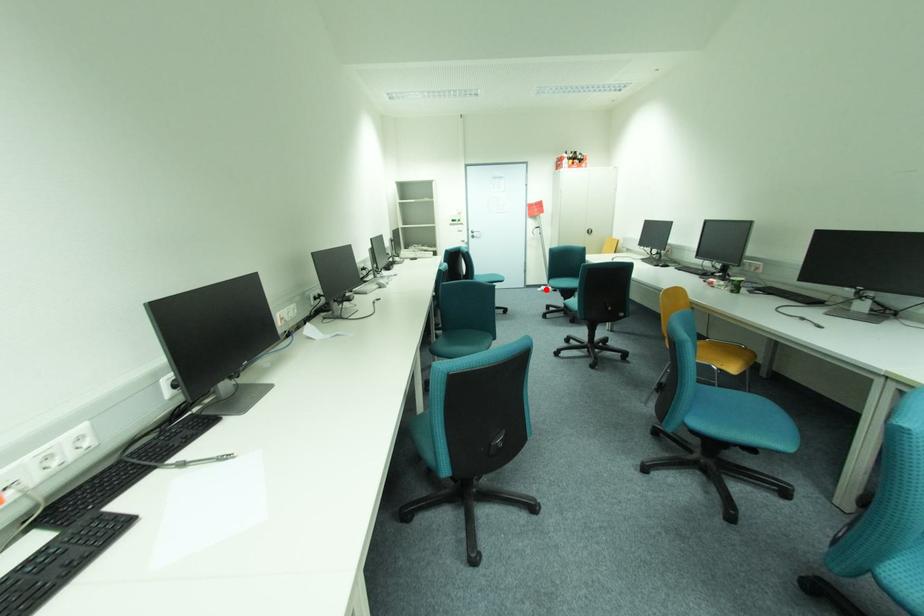
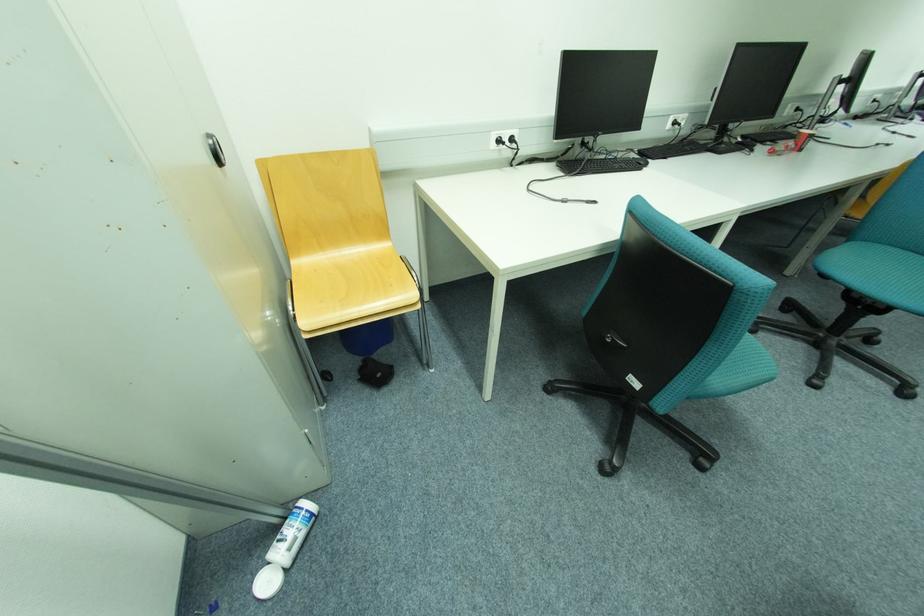
Question: I am providing you with two images of the same scene from different viewpoints. A red point is shown in image1. For the corresponding object point in image2, is it positioned nearer or farther from the camera?

Choices:
 (A) Nearer
 (B) Farther

Answer: (B)